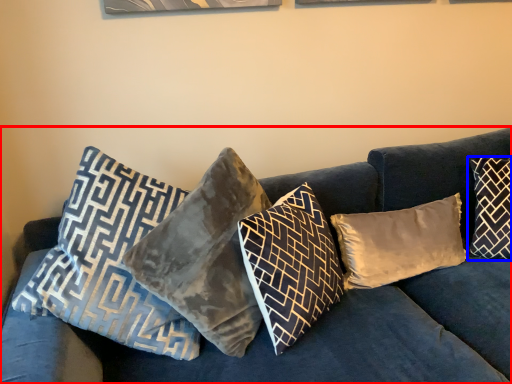
Question: Which object appears farthest to the camera in this image, studio couch (highlighted by a red box) or pillow (highlighted by a blue box)?

Choices:
 (A) studio couch
 (B) pillow

Answer: (B)